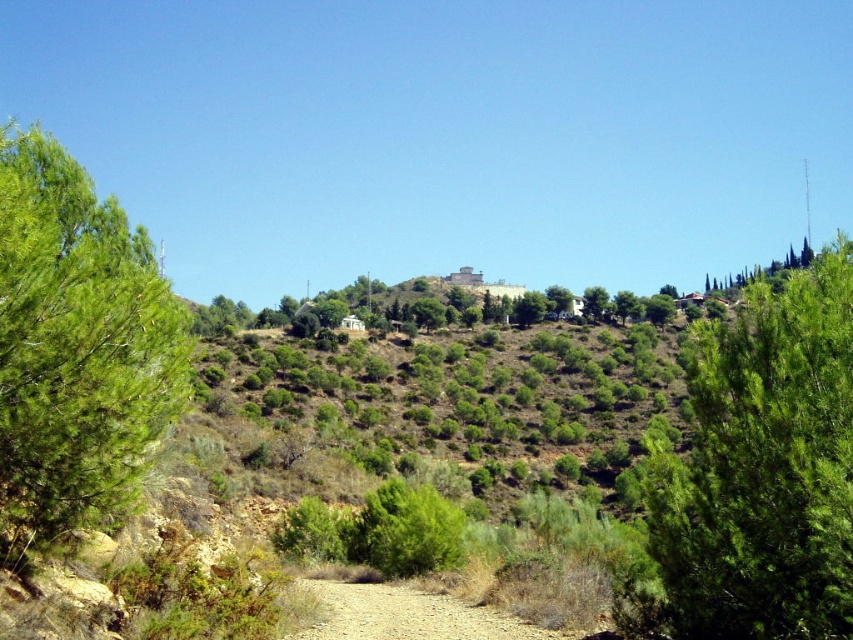
Question: Is green leafy bush at upper right positioned behind green leafy tree at upper right?

Choices:
 (A) yes
 (B) no

Answer: (B)

Question: Estimate the real-world distances between objects in this image. Which object is farther from the green leafy tree at upper right?

Choices:
 (A) green leafy bush at upper right
 (B) green needle-like at left
 (C) brown gravel path at center

Answer: (B)

Question: In this image, where is green needle-like at left located relative to brown gravel path at center?

Choices:
 (A) left
 (B) right

Answer: (A)

Question: Among these objects, which one is nearest to the camera?

Choices:
 (A) green leafy bush at upper right
 (B) green needle-like at left
 (C) green leafy tree at upper right
 (D) brown gravel path at center

Answer: (B)

Question: Which point appears closest to the camera in this image?

Choices:
 (A) (460, 634)
 (B) (33, 529)

Answer: (B)

Question: Can you confirm if green leafy bush at upper right is positioned above green leafy tree at upper right?

Choices:
 (A) yes
 (B) no

Answer: (B)